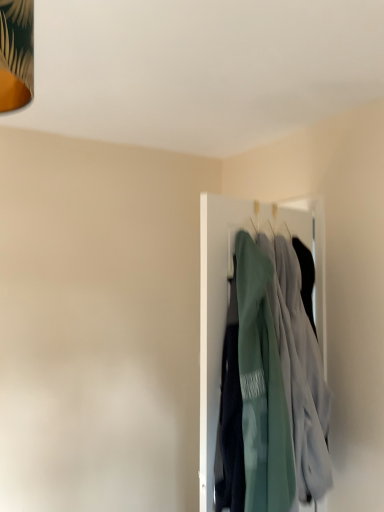
This screenshot has height=512, width=384. What do you see at coordinates (227, 300) in the screenshot? I see `matte green fabric at center` at bounding box center [227, 300].

Where is `matte green fabric at center`? This screenshot has height=512, width=384. matte green fabric at center is located at coordinates (227, 300).

I want to click on matte green fabric at center, so click(x=227, y=300).